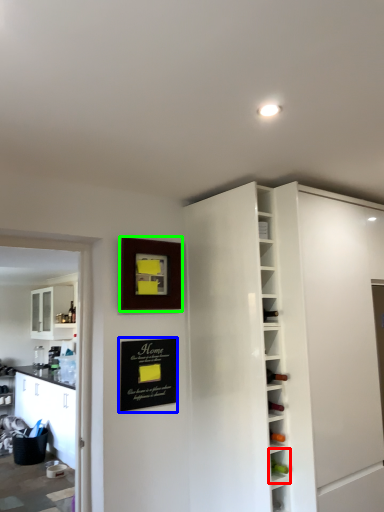
Question: Based on their relative distances, which object is farther from shelf (highlighted by a red box)? Choose from bulletin board (highlighted by a blue box) and picture frame (highlighted by a green box).

Choices:
 (A) bulletin board
 (B) picture frame

Answer: (B)